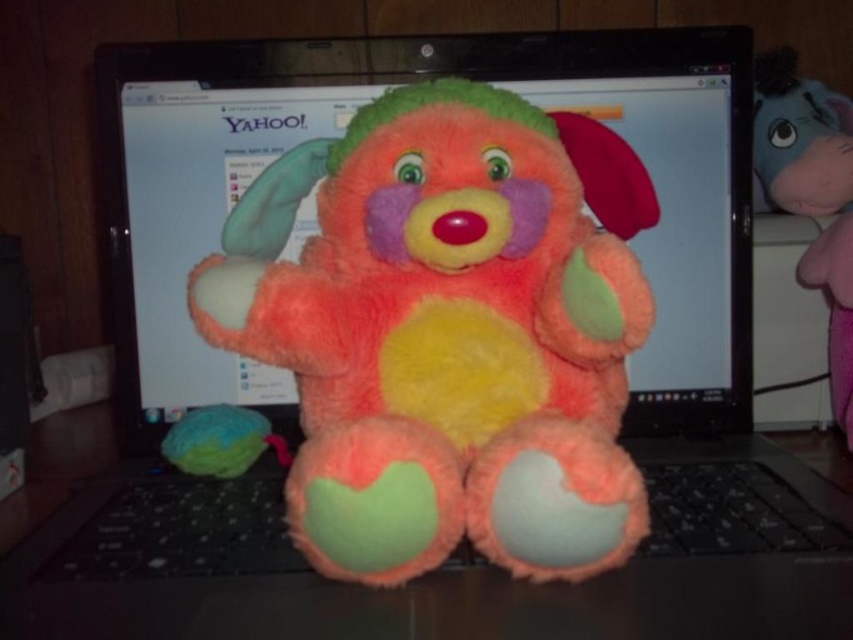
Between black plastic keyboard at center and matte green plush ball at lower left, which one has more height?

matte green plush ball at lower left is taller.

You are a GUI agent. You are given a task and a screenshot of the screen. Output one action in this format:
    pyautogui.click(x=<x>, y=<y>)
    Task: Click on the black plastic keyboard at center
    The height and width of the screenshot is (640, 853).
    Given the screenshot: What is the action you would take?
    pyautogui.click(x=180, y=531)

Identify the location of black plastic keyboard at center. (180, 531).

Can you confirm if fluffy multicolored stuffed animal at center is taller than matte green plush ball at lower left?

Correct, fluffy multicolored stuffed animal at center is much taller as matte green plush ball at lower left.

Can you confirm if fluffy multicolored stuffed animal at center is bigger than matte green plush ball at lower left?

Indeed, fluffy multicolored stuffed animal at center has a larger size compared to matte green plush ball at lower left.

Between point (296, 355) and point (184, 428), which one is positioned behind?

Positioned behind is point (184, 428).

I want to click on fluffy multicolored stuffed animal at center, so click(x=453, y=337).

From the picture: Does fluffy multicolored stuffed animal at center appear on the left side of pink plush elephant at right?

Correct, you'll find fluffy multicolored stuffed animal at center to the left of pink plush elephant at right.

How distant is fluffy multicolored stuffed animal at center from pink plush elephant at right?

fluffy multicolored stuffed animal at center and pink plush elephant at right are 38.20 centimeters apart.

Who is more distant from viewer, (244, 307) or (848, 145)?

Positioned behind is point (848, 145).

This screenshot has height=640, width=853. In order to click on fluffy multicolored stuffed animal at center in this screenshot , I will do `click(453, 337)`.